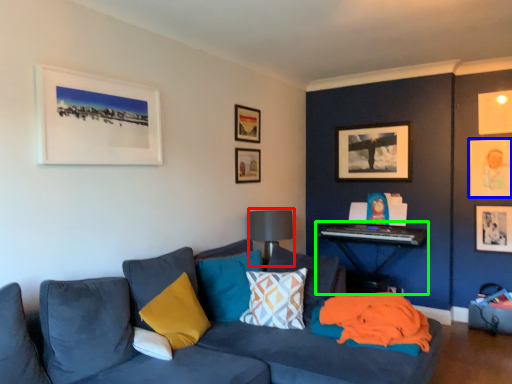
Question: Estimate the real-world distances between objects in this image. Which object is farther from lamp (highlighted by a red box), picture frame (highlighted by a blue box) or table (highlighted by a green box)?

Choices:
 (A) picture frame
 (B) table

Answer: (A)